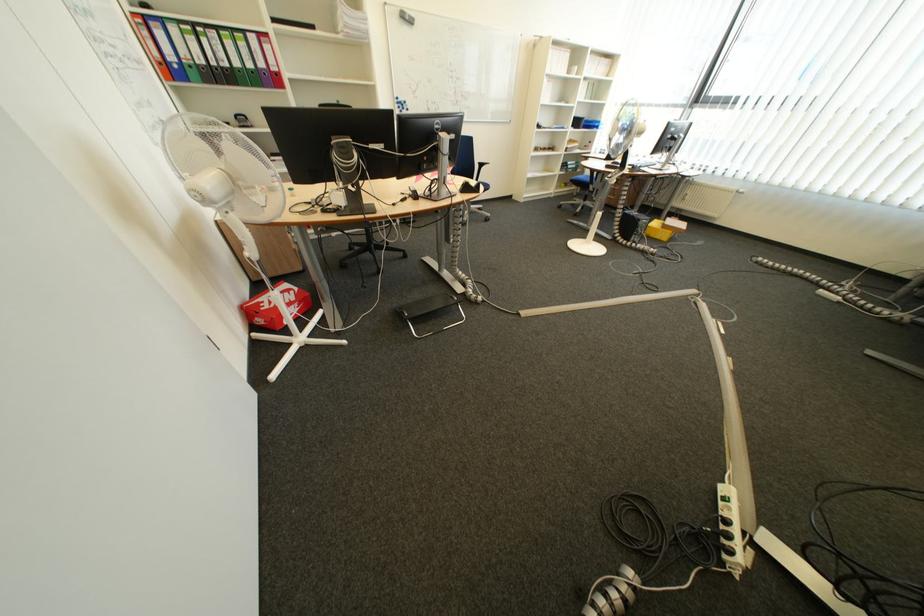
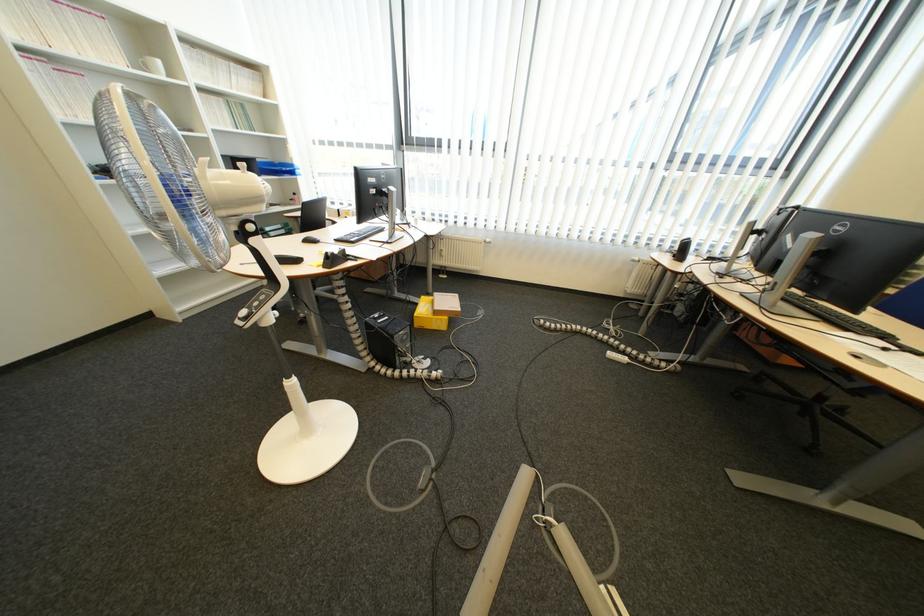
Find the pixel in the second image that matches (x=697, y=201) in the first image.

(455, 257)